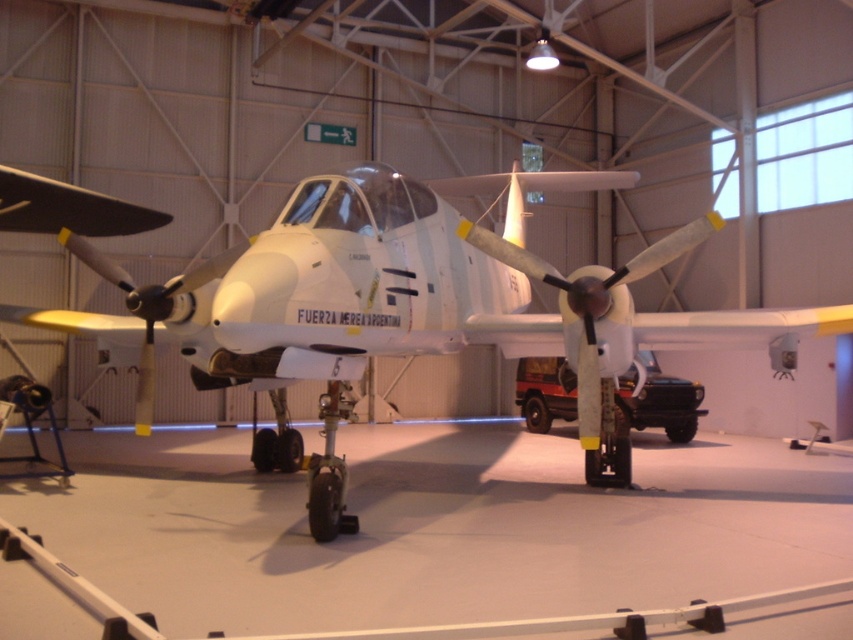
Based on the scene description, which object is larger between the white matte airplane at center and the white matte propeller at center?

The white matte propeller at center is larger than the white matte airplane at center according to the description.

You are standing in the hangar and see the point marked at coordinates (386, 298). Which object is this point located on?

The point marked at coordinates (386, 298) is located on the white matte airplane at center.